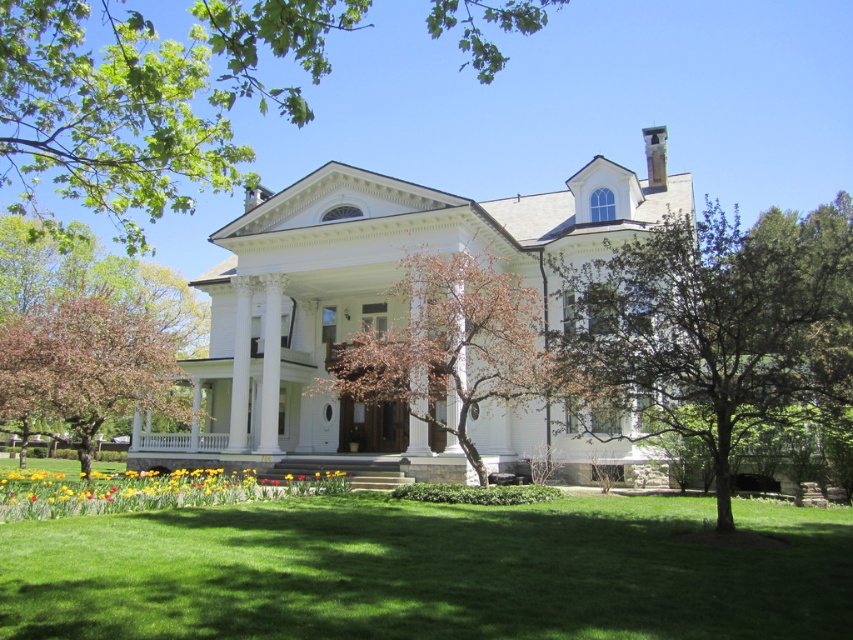
Question: In this image, where is green leafy tree at upper center located relative to yellow matte flowers at lower center?

Choices:
 (A) left
 (B) right

Answer: (B)

Question: Is green leafy tree at upper center wider than smooth pinkish-brown tree at lower left?

Choices:
 (A) no
 (B) yes

Answer: (B)

Question: Which point is farther to the camera?

Choices:
 (A) green leafy tree at upper center
 (B) green leafy tree at center

Answer: (B)

Question: Which point is farther from the camera taking this photo?

Choices:
 (A) (711, 244)
 (B) (16, 486)
 (C) (508, 289)

Answer: (C)

Question: Can you confirm if green grass at lower center is thinner than yellow matte flowers at lower center?

Choices:
 (A) no
 (B) yes

Answer: (A)

Question: Which of the following is the closest to the observer?

Choices:
 (A) green leafy tree at upper center
 (B) smooth pinkish-brown tree at lower left

Answer: (A)